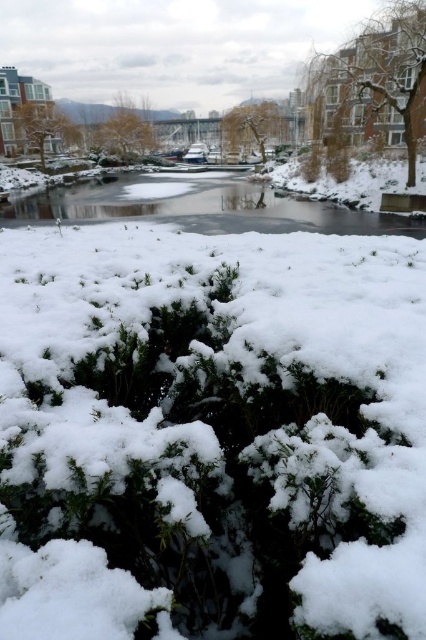
Question: Which object is closer to the camera taking this photo?

Choices:
 (A) clear ice water at center
 (B) brown textured tree at upper center
 (C) snow-covered tree at center

Answer: (A)

Question: Based on their relative distances, which object is nearer to the snow-covered tree at center?

Choices:
 (A) brown textured tree at upper center
 (B) snow-covered tree at upper right
 (C) white fluffy snow at center
 (D) brown textured tree at upper left

Answer: (A)

Question: Is brown textured tree at upper left to the right of snow-covered tree at center from the viewer's perspective?

Choices:
 (A) no
 (B) yes

Answer: (A)

Question: Is snow-covered tree at upper right to the right of brown textured tree at upper left from the viewer's perspective?

Choices:
 (A) yes
 (B) no

Answer: (A)

Question: Considering the real-world distances, which object is closest to the snow-covered tree at center?

Choices:
 (A) brown textured tree at upper center
 (B) snow-covered tree at upper right
 (C) white fluffy snow at center

Answer: (A)

Question: Can you confirm if snow-covered tree at upper right is smaller than brown textured tree at upper center?

Choices:
 (A) yes
 (B) no

Answer: (B)